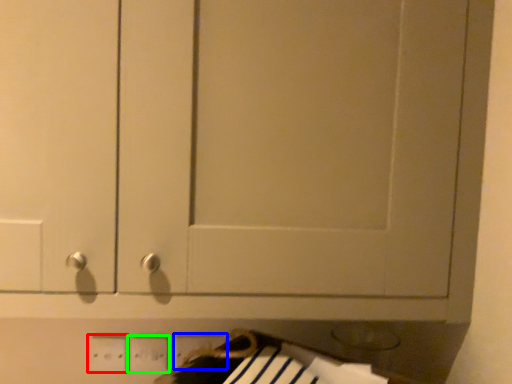
Question: Estimate the real-world distances between objects in this image. Which object is farther from electric outlet (highlighted by a red box), electric outlet (highlighted by a blue box) or electric outlet (highlighted by a green box)?

Choices:
 (A) electric outlet
 (B) electric outlet

Answer: (A)